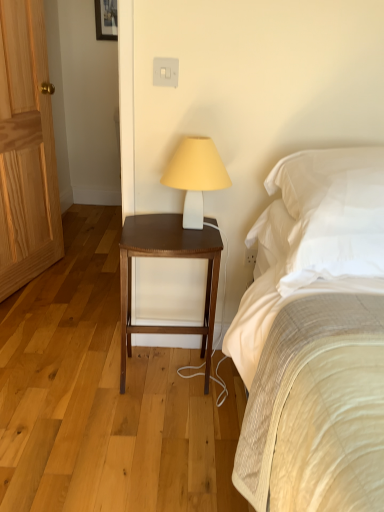
At what (x,y) coordinates should I click in order to perform the action: click on vacant area that is in front of natural wood door at left. Please return your answer as a coordinate pair (x, y). Looking at the image, I should click on (42, 305).